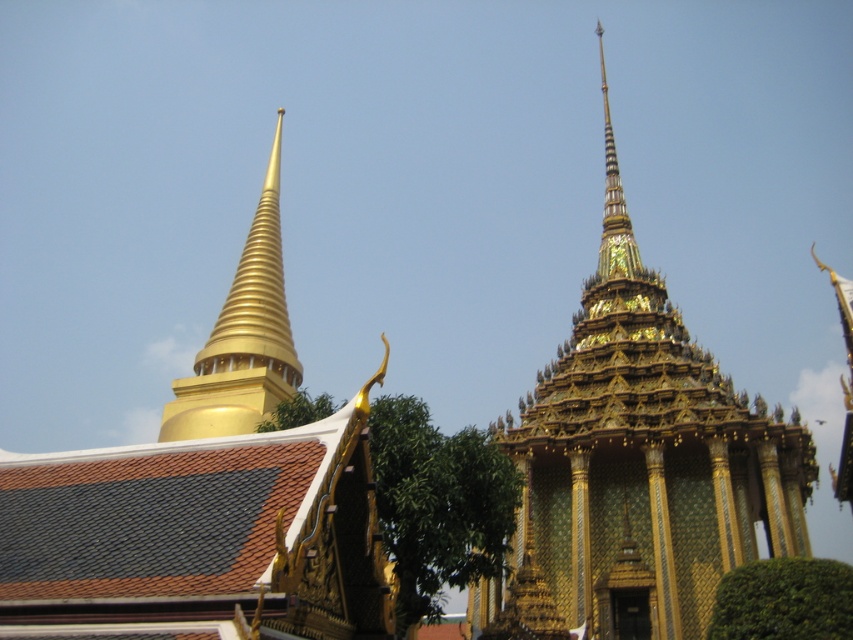
You are standing at the entrance of the temple complex and want to locate the gold mosaic temple at center. According to the coordinates provided, where should you look relative to your current position?

The gold mosaic temple at center is located at coordinates 0.727 on the x axis and 0.749 on the y axis, so you should look towards the lower right direction from your current position at the entrance.

Based on the photo, you are standing in front of the temple complex and want to take a photo of both the gold mosaic temple at center and the gold polished spire at upper left. Which one should you focus on first to ensure both are in sharp focus?

You should focus on the gold polished spire at upper left first because it is farther away than the gold mosaic temple at center, so adjusting focus from far to near can help ensure both are in sharp focus.